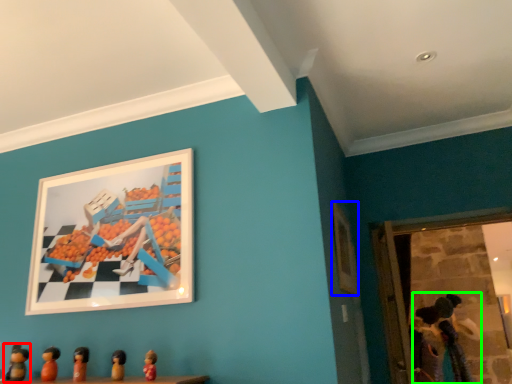
Question: Based on their relative distances, which object is nearer to toy (highlighted by a red box)? Choose from picture frame (highlighted by a blue box) and toy (highlighted by a green box).

Choices:
 (A) picture frame
 (B) toy

Answer: (A)